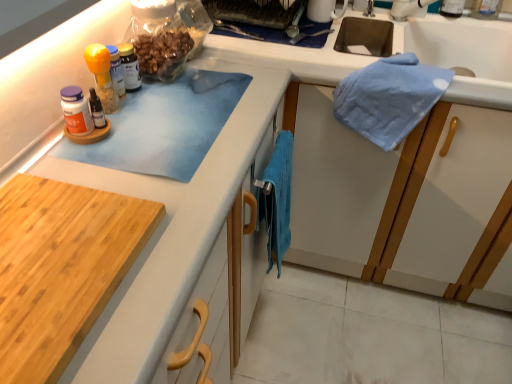
This screenshot has height=384, width=512. What are the coordinates of `vacant space in front of translucent plastic bottle at center` in the screenshot? It's located at (137, 125).